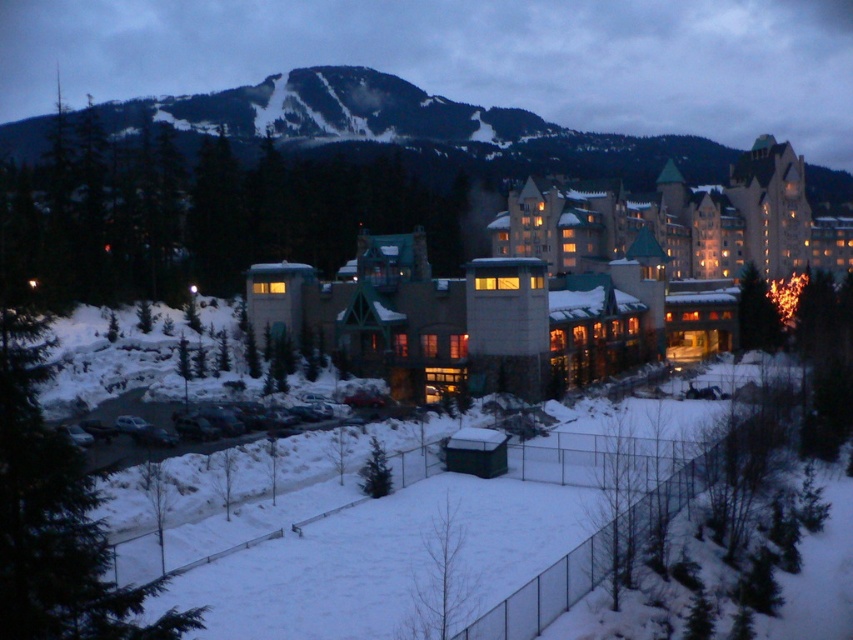
Between matte stone building at center and white snow at lower center, which one appears on the right side from the viewer's perspective?

Positioned to the right is matte stone building at center.

Does matte stone building at center have a greater height compared to white snow at lower center?

Yes.

Is point (512, 264) positioned after point (675, 444)?

Yes.

Locate an element on the screen. This screenshot has height=640, width=853. matte stone building at center is located at coordinates (554, 278).

Is matte stone building at center further to the viewer compared to snowy forested mountain at upper center?

No, matte stone building at center is in front of snowy forested mountain at upper center.

Does matte stone building at center appear on the left side of snowy forested mountain at upper center?

Correct, you'll find matte stone building at center to the left of snowy forested mountain at upper center.

Find the location of `matte stone building at center`. matte stone building at center is located at coordinates (554, 278).

Is point (426, 132) positioned after point (693, 477)?

Yes, it is behind point (693, 477).

The width and height of the screenshot is (853, 640). Describe the element at coordinates (410, 129) in the screenshot. I see `snowy forested mountain at upper center` at that location.

Is point (207, 93) closer to camera compared to point (665, 490)?

No, (207, 93) is further to viewer.

Image resolution: width=853 pixels, height=640 pixels. I want to click on snowy forested mountain at upper center, so click(410, 129).